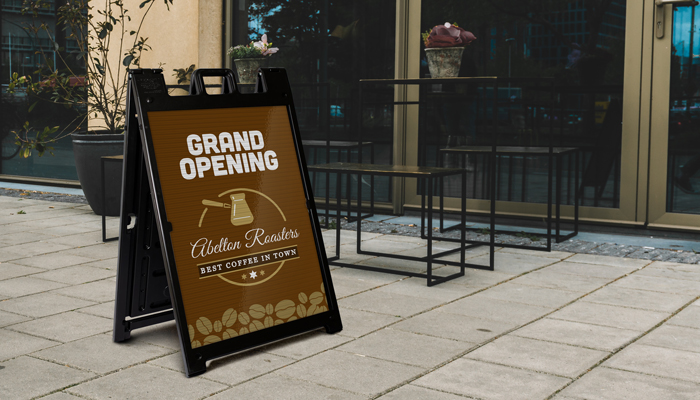
This screenshot has height=400, width=700. What are the coordinates of `window doorway` in the screenshot? It's located at (600, 90).